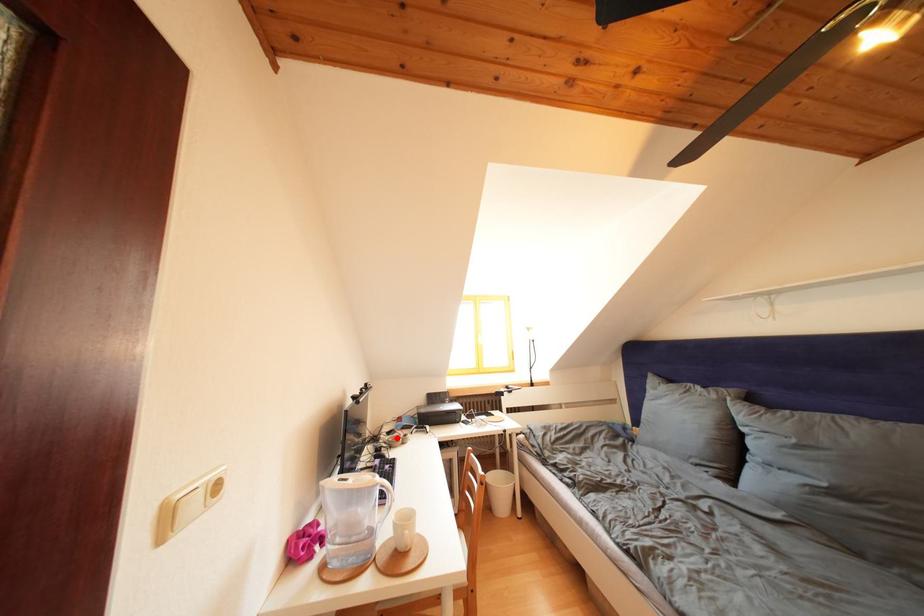
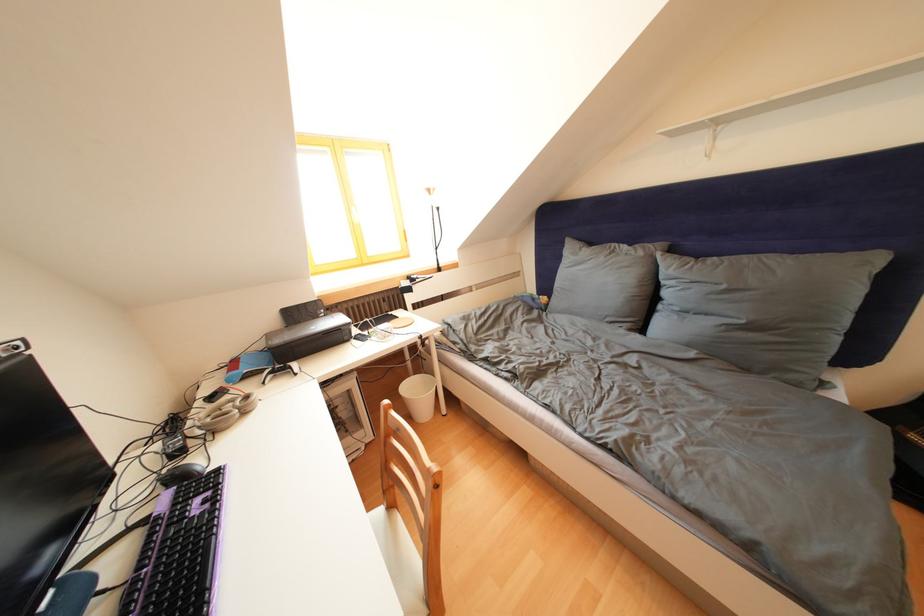
In the second image, find the point that corresponds to the highlighted location in the first image.

(220, 403)